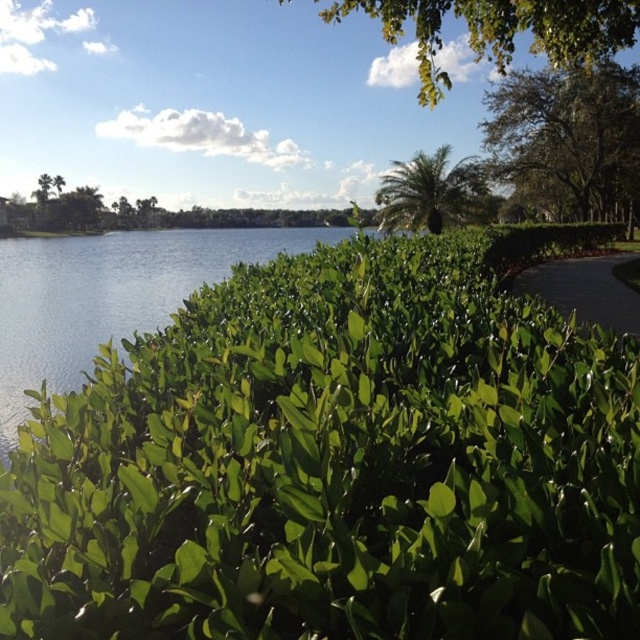
You are standing at the edge of the lake and want to take a photo of both the green leafy hedge at center and the green leafy tree at upper right. Which object should you position closer to the left side of your camera frame to include both in the photo?

To include both the green leafy hedge at center and the green leafy tree at upper right in your photo, you should position the green leafy hedge at center on the left side of your camera frame since it is already on the left side of the green leafy tree at upper right.

Based on the photo, you are standing at the edge of the lake and want to take a photo of both the green leafy hedge at center and the green leafy tree at upper center. Which object should you focus on first if you want to capture both in a single frame without moving your camera?

The green leafy hedge at center should be focused on first because it is closer to you than the green leafy tree at upper center. By focusing on the closer object, you can ensure both are in the frame as the tree is further away but still within the camera view.

You are standing at the lakeside and see the green leafy hedge at center and the green leafy tree at upper right. Which object is closer to you?

The green leafy hedge at center is closer to you because it is in front of the green leafy tree at upper right.